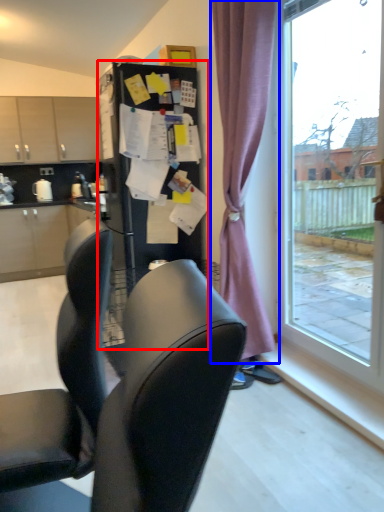
Question: Which object appears farthest to the camera in this image, fridge (highlighted by a red box) or curtain (highlighted by a blue box)?

Choices:
 (A) fridge
 (B) curtain

Answer: (A)